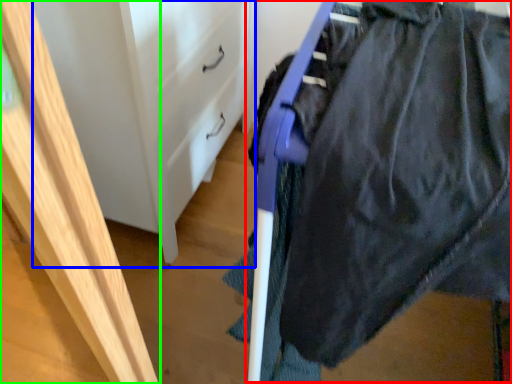
Question: Based on their relative distances, which object is nearer to wide (highlighted by a red box)? Choose from file cabinet (highlighted by a blue box) and furniture (highlighted by a green box).

Choices:
 (A) file cabinet
 (B) furniture

Answer: (B)